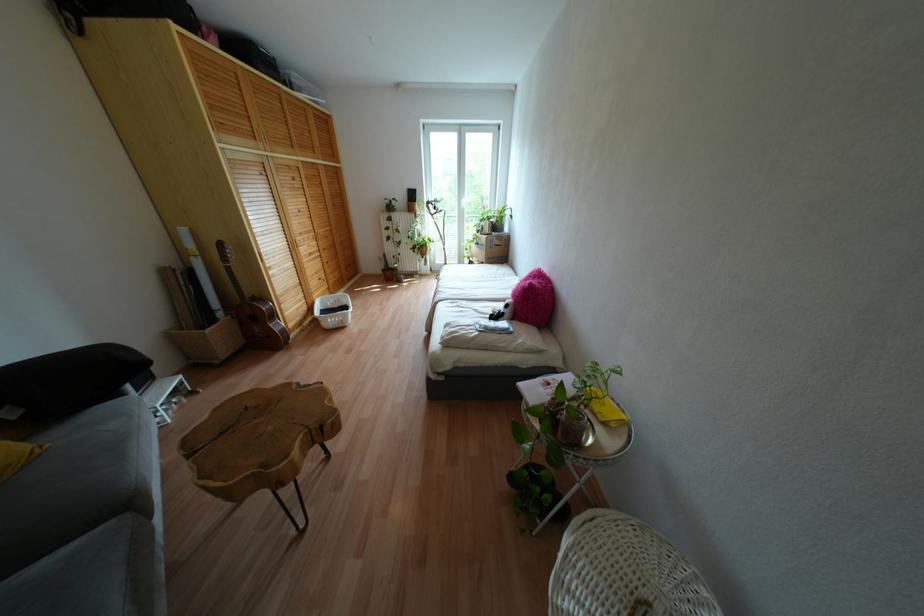
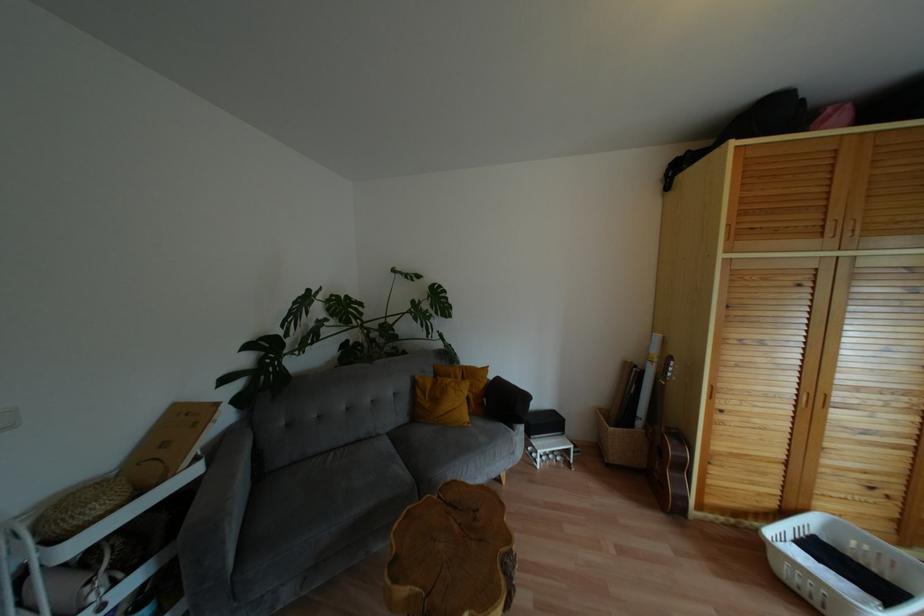
Question: The images are taken continuously from a first-person perspective. In which direction is your viewpoint rotating?

Choices:
 (A) Left
 (B) Right
 (C) Up
 (D) Down

Answer: (A)